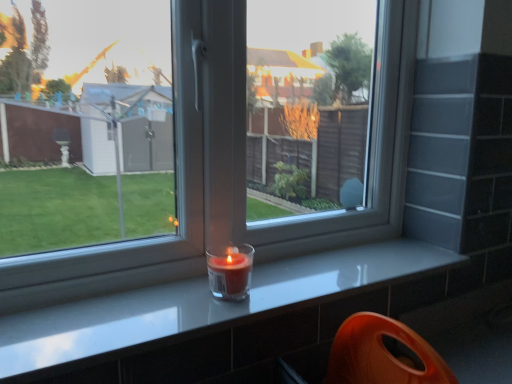
Question: Is smooth gray counter at center at the left side of translucent glass candle at window?

Choices:
 (A) no
 (B) yes

Answer: (A)

Question: Can you confirm if smooth gray counter at center is thinner than translucent glass candle at window?

Choices:
 (A) yes
 (B) no

Answer: (B)

Question: Is translucent glass candle at window located within smooth gray counter at center?

Choices:
 (A) no
 (B) yes

Answer: (A)

Question: From the image's perspective, is smooth gray counter at center on translucent glass candle at window?

Choices:
 (A) no
 (B) yes

Answer: (A)

Question: From a real-world perspective, is smooth gray counter at center positioned under translucent glass candle at window based on gravity?

Choices:
 (A) no
 (B) yes

Answer: (B)

Question: Is smooth gray counter at center facing away from translucent glass candle at window?

Choices:
 (A) yes
 (B) no

Answer: (B)

Question: Is translucent glass candle at window smaller than smooth gray counter at center?

Choices:
 (A) no
 (B) yes

Answer: (B)

Question: Considering the relative positions of translucent glass candle at window and smooth gray counter at center in the image provided, is translucent glass candle at window behind smooth gray counter at center?

Choices:
 (A) no
 (B) yes

Answer: (B)

Question: Does translucent glass candle at window have a lesser width compared to smooth gray counter at center?

Choices:
 (A) no
 (B) yes

Answer: (B)

Question: Is smooth gray counter at center located within translucent glass candle at window?

Choices:
 (A) no
 (B) yes

Answer: (A)

Question: From the image's perspective, is translucent glass candle at window located beneath smooth gray counter at center?

Choices:
 (A) yes
 (B) no

Answer: (B)

Question: Is translucent glass candle at window taller than smooth gray counter at center?

Choices:
 (A) yes
 (B) no

Answer: (A)

Question: Is translucent glass candle at window bigger or smaller than smooth gray counter at center?

Choices:
 (A) big
 (B) small

Answer: (B)